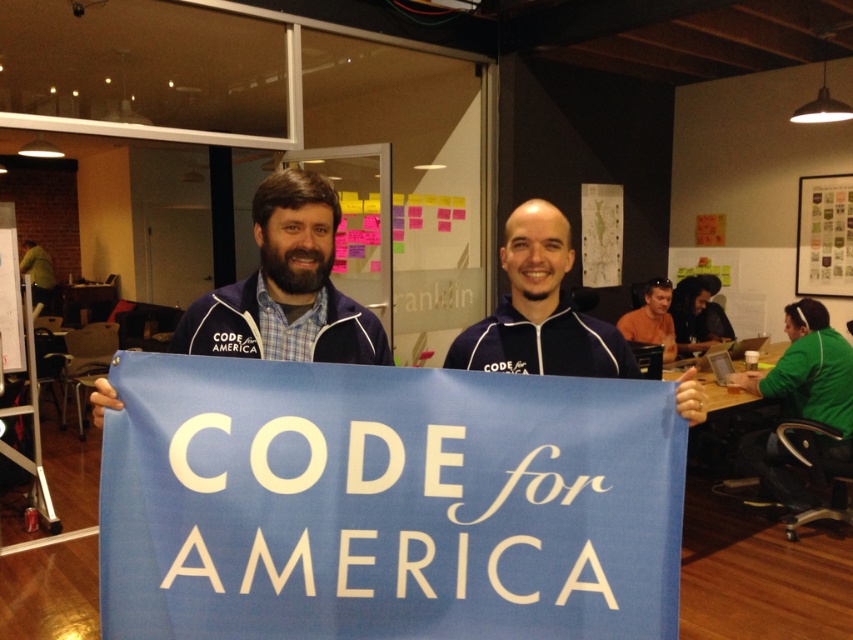
You are organizing a photo shoot and need to place two blue fabrics in the scene. The scene has a blue fabric at center and a blue fabric banner at center. According to the spatial arrangement, which one should be placed to the left to ensure accuracy?

The blue fabric at center should be placed to the left of the blue fabric banner at center because the description states that the blue fabric at center is positioned on the left side of the blue fabric banner at center.

You are standing in the collaborative workspace and want to take a photo of both the point at coordinates point [598,387] and point [515,288]. Which point should you focus on first to ensure both are in clear view?

You should focus on point [598,387] first because it is closer to the camera than point [515,288], ensuring both points are in clear view.